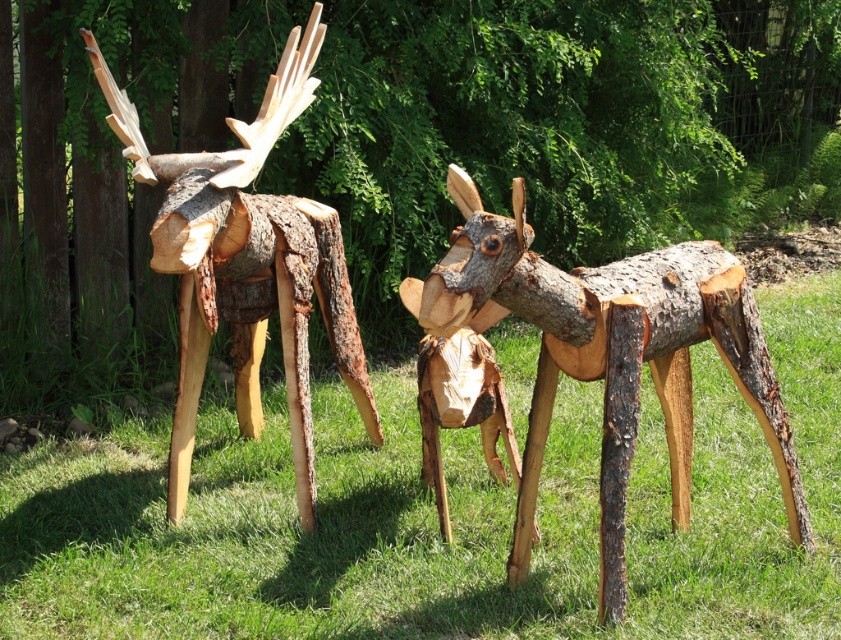
You are standing in a park and see the green grass at center and the natural wood moose at center. Which object is located to the right of the other?

The green grass at center is to the right of the natural wood moose at center.